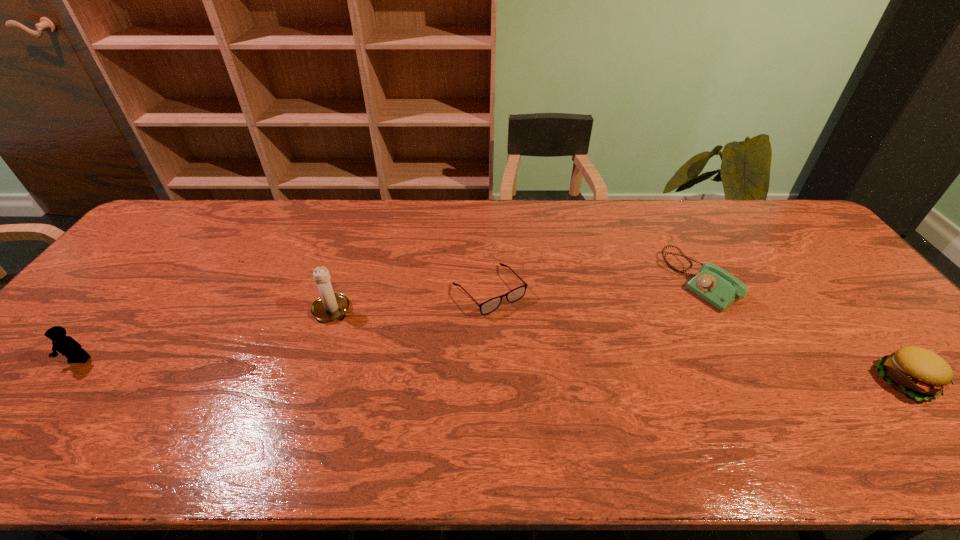
Image resolution: width=960 pixels, height=540 pixels. Identify the location of vacant space on the desktop that is between the fourth shortest object and the hamburger and is positioned on the front-facing side of the shortest object. (563, 372).

Locate an element on the screen. free space on the desktop that is between the Lego and the hamburger and is positioned on the handle side of the fourth object from right to left is located at coordinates (427, 369).

Identify the location of vacant space on the desktop that is between the Lego and the rightmost object and is positioned on the dial of the fourth tallest object. This screenshot has width=960, height=540. click(x=551, y=372).